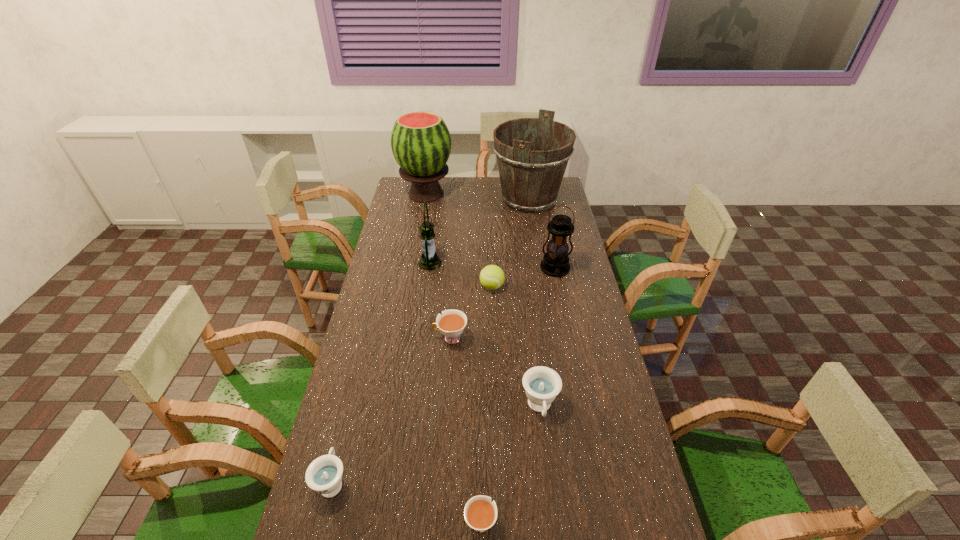
Where is `free spot at the left edge of the desktop`? The height and width of the screenshot is (540, 960). free spot at the left edge of the desktop is located at coordinates (372, 323).

At what (x,y) coordinates should I click in order to perform the action: click on vacant space at the right edge of the desktop. Please return your answer as a coordinate pair (x, y). Looking at the image, I should click on (593, 359).

What are the coordinates of `free spot between the farthest teacup and the smaller blue teacup` in the screenshot? It's located at (x=392, y=410).

Identify the location of empty location between the green lantern and the left blue teacup. (381, 372).

The width and height of the screenshot is (960, 540). Identify the location of free space between the third nearest teacup and the tennis ball. (516, 347).

Where is `vacant space in between the farthest teacup and the black lantern`? This screenshot has height=540, width=960. vacant space in between the farthest teacup and the black lantern is located at coordinates (503, 303).

The width and height of the screenshot is (960, 540). Identify the location of vacant area between the third nearest object and the watermelon. (483, 301).

Identify the location of empty space between the third nearest object and the bucket. (535, 303).

Where is `object that can be found as the second closest to the seventh farthest object`? object that can be found as the second closest to the seventh farthest object is located at coordinates (451, 323).

Where is `object that stands as the sixth closest to the right lantern`? object that stands as the sixth closest to the right lantern is located at coordinates (421, 144).